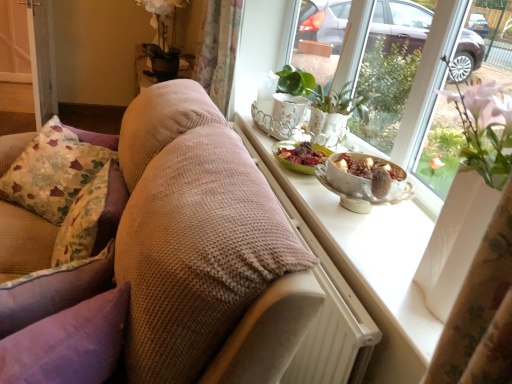
Question: Can you confirm if matte white windowsill at upper right is wider than floral fabric pillow at left, arranged as the first pillow when viewed from the back?

Choices:
 (A) yes
 (B) no

Answer: (A)

Question: Is matte white windowsill at upper right outside of floral fabric pillow at left, arranged as the first pillow when viewed from the back?

Choices:
 (A) no
 (B) yes

Answer: (B)

Question: Is matte white windowsill at upper right shorter than floral fabric pillow at left, which is counted as the third pillow, starting from the front?

Choices:
 (A) yes
 (B) no

Answer: (B)

Question: Is matte white windowsill at upper right far away from floral fabric pillow at left, which is counted as the third pillow, starting from the front?

Choices:
 (A) no
 (B) yes

Answer: (B)

Question: Are matte white windowsill at upper right and floral fabric pillow at left, which is counted as the third pillow, starting from the front, beside each other?

Choices:
 (A) no
 (B) yes

Answer: (A)

Question: Considering the relative positions of matte white windowsill at upper right and metallic silver screen door at left in the image provided, is matte white windowsill at upper right to the left or to the right of metallic silver screen door at left?

Choices:
 (A) left
 (B) right

Answer: (B)

Question: Do you think matte white windowsill at upper right is within metallic silver screen door at left, or outside of it?

Choices:
 (A) inside
 (B) outside

Answer: (B)

Question: Considering the positions of matte white windowsill at upper right and metallic silver screen door at left in the image, is matte white windowsill at upper right taller or shorter than metallic silver screen door at left?

Choices:
 (A) short
 (B) tall

Answer: (A)

Question: From the image's perspective, is matte white windowsill at upper right positioned above or below metallic silver screen door at left?

Choices:
 (A) above
 (B) below

Answer: (B)

Question: Considering the positions of floral fabric cushion at left, placed as the 2th pillow when sorted from front to back, and purple velvet pillow at left, positioned as the first pillow in front-to-back order, in the image, is floral fabric cushion at left, placed as the 2th pillow when sorted from front to back, taller or shorter than purple velvet pillow at left, positioned as the first pillow in front-to-back order,?

Choices:
 (A) tall
 (B) short

Answer: (B)

Question: From a real-world perspective, relative to purple velvet pillow at left, which ranks as the 3th pillow in back-to-front order, is floral fabric cushion at left, which ranks as the second pillow in back-to-front order, vertically above or below?

Choices:
 (A) above
 (B) below

Answer: (B)

Question: Looking at the image, does floral fabric cushion at left, which ranks as the second pillow in back-to-front order, seem bigger or smaller compared to purple velvet pillow at left, positioned as the first pillow in front-to-back order?

Choices:
 (A) big
 (B) small

Answer: (A)

Question: Is floral fabric cushion at left, placed as the 2th pillow when sorted from front to back, situated inside purple velvet pillow at left, positioned as the first pillow in front-to-back order, or outside?

Choices:
 (A) outside
 (B) inside

Answer: (A)

Question: In the image, is porcelain bowl with fruit at window sill positioned in front of or behind woven fabric couch at center?

Choices:
 (A) front
 (B) behind

Answer: (B)

Question: Which is correct: porcelain bowl with fruit at window sill is inside woven fabric couch at center, or outside of it?

Choices:
 (A) outside
 (B) inside

Answer: (A)